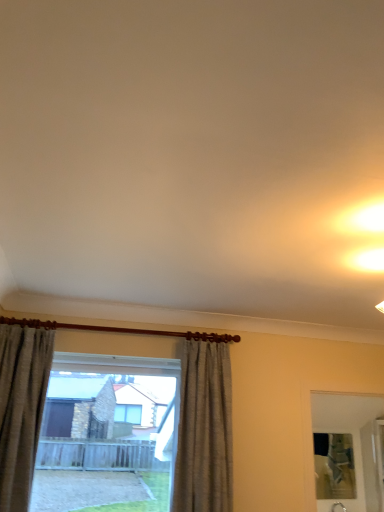
Question: Is textured beige curtain at left, which ranks as the 2th curtain in right-to-left order, positioned with its back to clear glass window at center?

Choices:
 (A) yes
 (B) no

Answer: (B)

Question: Does textured beige curtain at left, which ranks as the 2th curtain in right-to-left order, have a greater height compared to clear glass window at center?

Choices:
 (A) no
 (B) yes

Answer: (B)

Question: From a real-world perspective, does textured beige curtain at left, positioned as the 1th curtain in left-to-right order, stand above clear glass window at center?

Choices:
 (A) no
 (B) yes

Answer: (B)

Question: From the image's perspective, is textured beige curtain at left, which ranks as the 2th curtain in right-to-left order, below clear glass window at center?

Choices:
 (A) no
 (B) yes

Answer: (A)

Question: Would you say textured beige curtain at left, positioned as the 1th curtain in left-to-right order, contains clear glass window at center?

Choices:
 (A) no
 (B) yes

Answer: (A)

Question: Would you say gray fabric curtain at center, the 2th curtain positioned from the left, is inside or outside clear glass window at center?

Choices:
 (A) inside
 (B) outside

Answer: (B)

Question: From a real-world perspective, relative to clear glass window at center, is gray fabric curtain at center, the 2th curtain positioned from the left, vertically above or below?

Choices:
 (A) below
 (B) above

Answer: (B)

Question: Is point (196, 407) closer or farther from the camera than point (9, 325)?

Choices:
 (A) farther
 (B) closer

Answer: (A)

Question: From the image's perspective, is gray fabric curtain at center, the 2th curtain positioned from the left, located above or below clear glass window at center?

Choices:
 (A) below
 (B) above

Answer: (B)

Question: Is point (26, 374) closer or farther from the camera than point (228, 478)?

Choices:
 (A) closer
 (B) farther

Answer: (A)

Question: Considering the positions of textured beige curtain at left, which ranks as the 2th curtain in right-to-left order, and clear glass window at center in the image, is textured beige curtain at left, which ranks as the 2th curtain in right-to-left order, bigger or smaller than clear glass window at center?

Choices:
 (A) big
 (B) small

Answer: (B)

Question: Based on their positions, is textured beige curtain at left, which ranks as the 2th curtain in right-to-left order, located to the left or right of clear glass window at center?

Choices:
 (A) left
 (B) right

Answer: (A)

Question: Is textured beige curtain at left, positioned as the 1th curtain in left-to-right order, wider or thinner than clear glass window at center?

Choices:
 (A) wide
 (B) thin

Answer: (A)

Question: Based on their positions, is clear glass window at center located to the left or right of textured beige curtain at left, which ranks as the 2th curtain in right-to-left order?

Choices:
 (A) left
 (B) right

Answer: (B)

Question: In terms of width, does clear glass window at center look wider or thinner when compared to textured beige curtain at left, which ranks as the 2th curtain in right-to-left order?

Choices:
 (A) thin
 (B) wide

Answer: (A)